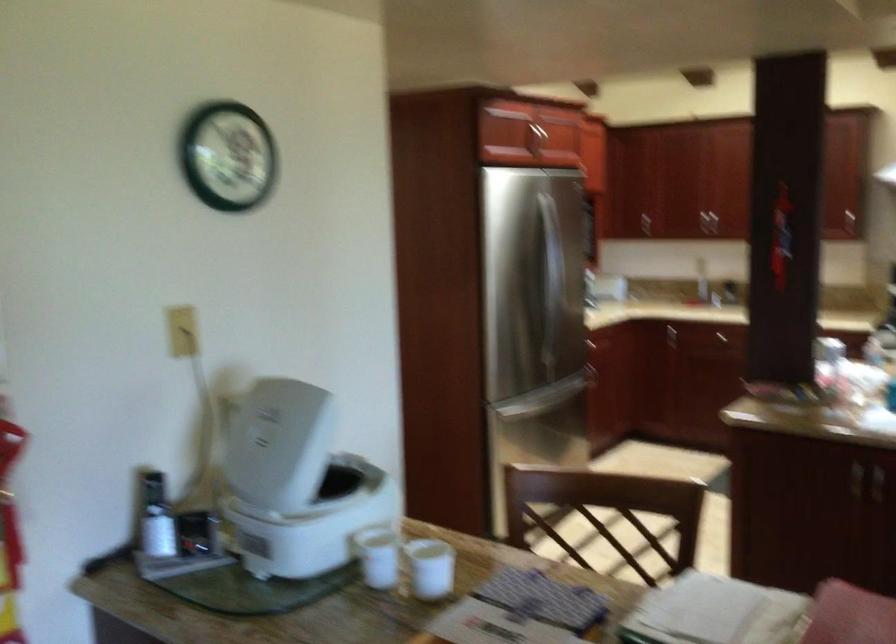
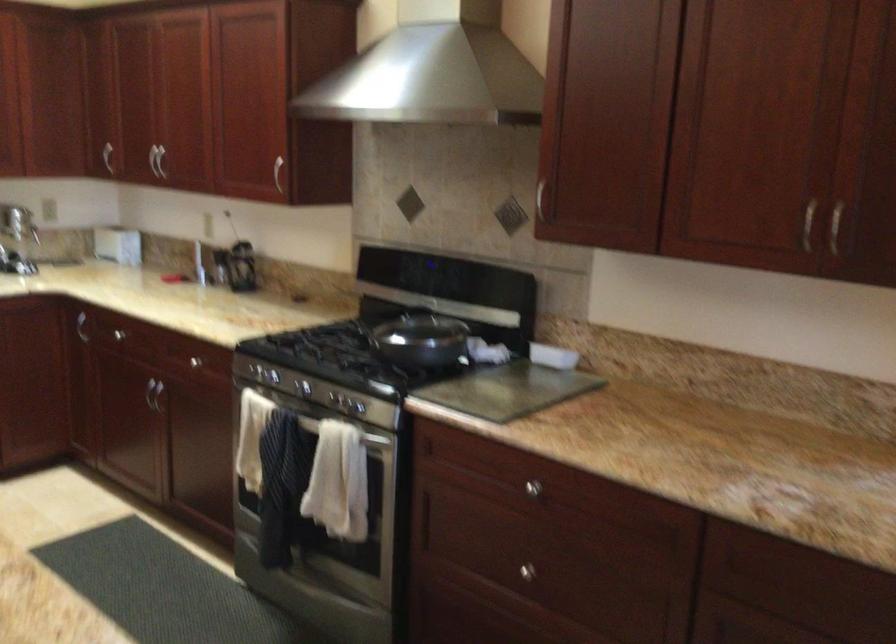
The images are taken continuously from a first-person perspective. In which direction are you moving?

The cameraman moved toward right, forward.